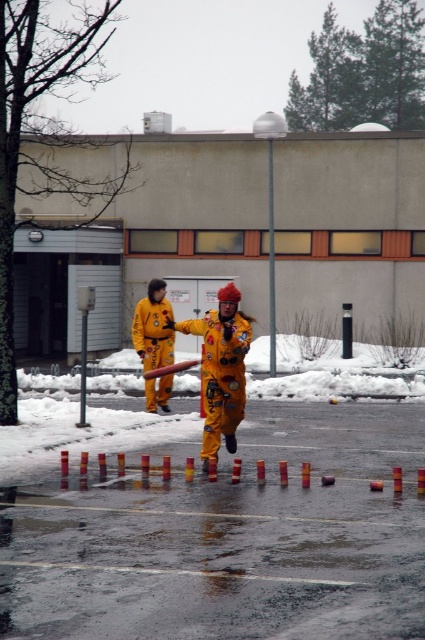
Who is lower down, yellow fabric fireman at center or yellow matte uniform at center?

yellow matte uniform at center is lower down.

Is yellow fabric fireman at center shorter than yellow matte uniform at center?

Indeed, yellow fabric fireman at center has a lesser height compared to yellow matte uniform at center.

Which is in front, point (224, 308) or point (150, 365)?

Positioned in front is point (224, 308).

The width and height of the screenshot is (425, 640). Find the location of `yellow fabric fireman at center`. yellow fabric fireman at center is located at coordinates (221, 369).